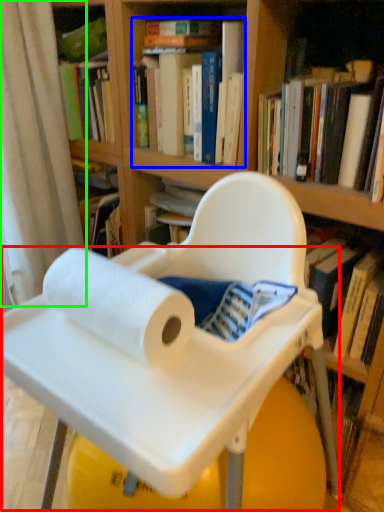
Question: Which is nearer to the table (highlighted by a red box)? book (highlighted by a blue box) or curtain (highlighted by a green box).

Choices:
 (A) book
 (B) curtain

Answer: (A)